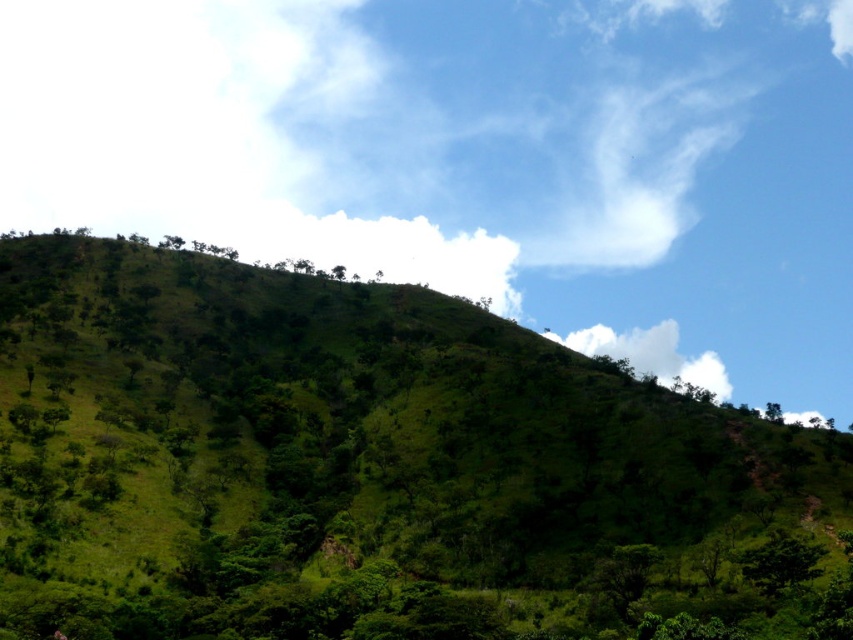
Looking at this image, how distant is green leafy tree at lower right from green leafy tree at upper center?

685.76 feet

This screenshot has width=853, height=640. What do you see at coordinates (780, 561) in the screenshot? I see `green leafy tree at lower right` at bounding box center [780, 561].

Locate an element on the screen. Image resolution: width=853 pixels, height=640 pixels. green leafy tree at lower right is located at coordinates (780, 561).

Does white fluffy cloud at upper center have a greater height compared to green leafy tree at upper center?

Correct, white fluffy cloud at upper center is much taller as green leafy tree at upper center.

Does point (625, 346) come behind point (343, 278)?

Yes, it is.

Locate an element on the screen. This screenshot has height=640, width=853. white fluffy cloud at upper center is located at coordinates (651, 353).

Does white fluffy cloud at upper center appear on the right side of green leafy tree at lower right?

Indeed, white fluffy cloud at upper center is positioned on the right side of green leafy tree at lower right.

Based on the photo, who is positioned more to the left, white fluffy cloud at upper center or green leafy tree at lower right?

green leafy tree at lower right is more to the left.

Is point (672, 340) more distant than point (750, 572)?

Yes, it is.

Where is `white fluffy cloud at upper center`? white fluffy cloud at upper center is located at coordinates (651, 353).